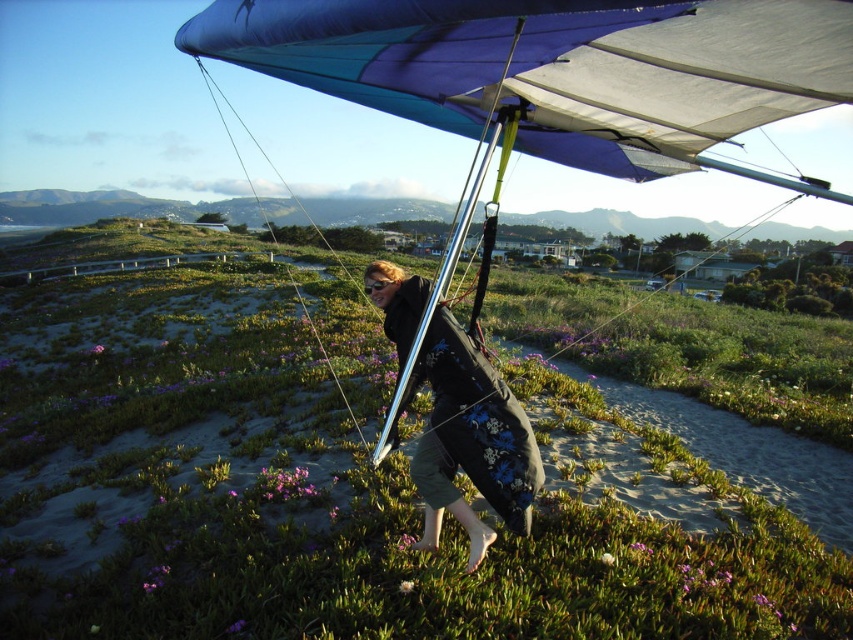
Looking at this image, you are a hang glider pilot and you want to take a photo of the point at coordinate point [16,536]. The camera you are using has a focal length of 50mm and a sensor size of 24mm x 36mm. The point is 5.61 meters away from the camera. What is the angle of view required to capture the point in the center of the photo?

The angle of view required to capture the point at coordinate point [16,536] in the center of the photo can be calculated using the formula for angle of view. The formula is 2 arctan, where the subject distance is 5.61 meters and the sensor dimension is 24mm. Plugging in the values, the angle of view would be approximately 26.5 degrees. However, since the point is already at the center, the angle of view must be sufficient to include it, so the required angle of view is approximately 26.5 degrees.

You are a photographer capturing the hang gliding scene. You notice the black floral dress at center and the purple matte flower at lower center. Which object is positioned to the right side of the other?

The black floral dress at center is positioned to the right of the purple matte flower at lower center.